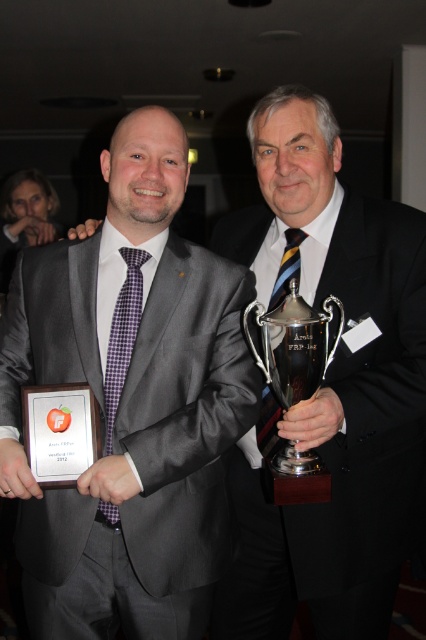
Does point (386, 376) come in front of point (363, 369)?

Yes, point (386, 376) is closer to viewer.

Which is more to the left, matte gray suit at center or black satin business suit at center?

From the viewer's perspective, matte gray suit at center appears more on the left side.

Between point (241, 563) and point (334, 355), which one is positioned behind?

Point (241, 563)

I want to click on matte gray suit at center, so click(x=328, y=388).

How much distance is there between matte gray suit at center and gray wool suit at center?

A distance of 13.04 inches exists between matte gray suit at center and gray wool suit at center.

What do you see at coordinates (328, 388) in the screenshot? I see `matte gray suit at center` at bounding box center [328, 388].

This screenshot has height=640, width=426. Identify the location of matte gray suit at center. (328, 388).

Find the location of a particular element. The width and height of the screenshot is (426, 640). matte gray suit at center is located at coordinates (328, 388).

Can you confirm if matte gray suit at center is wider than silver metallic trophy at center?

Correct, the width of matte gray suit at center exceeds that of silver metallic trophy at center.

This screenshot has width=426, height=640. Identify the location of matte gray suit at center. (328, 388).

Where is `matte gray suit at center`? matte gray suit at center is located at coordinates (328, 388).